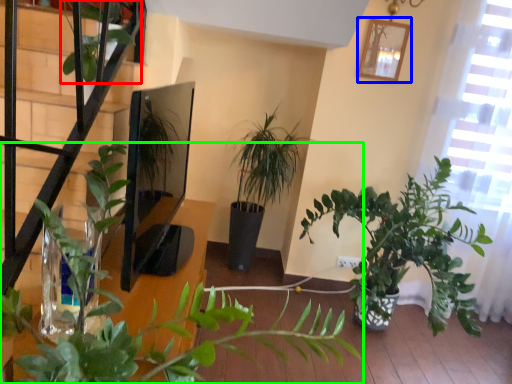
Question: Which object is positioned closest to vegetation (highlighted by a red box)? Select from picture frame (highlighted by a blue box) and houseplant (highlighted by a green box).

Choices:
 (A) picture frame
 (B) houseplant

Answer: (B)